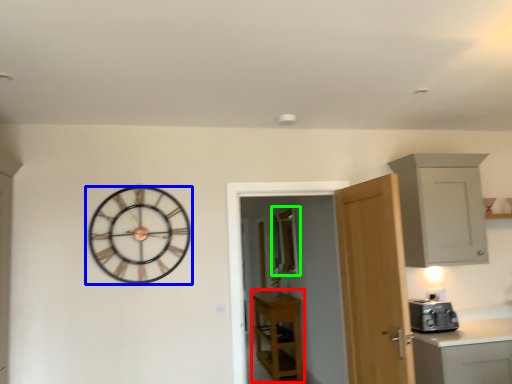
Question: Which object is positioned farthest from cabinetry (highlighted by a red box)? Select from wall clock (highlighted by a blue box) and window (highlighted by a green box).

Choices:
 (A) wall clock
 (B) window

Answer: (A)